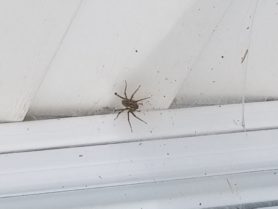
This screenshot has width=278, height=209. Find the location of `cobweb`. cobweb is located at coordinates (164, 178).